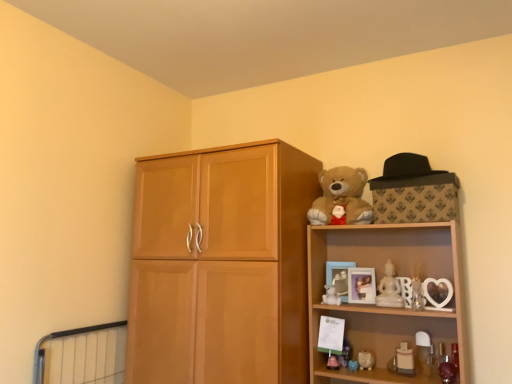
Question: Does white glossy piggy bank at lower right, the second toy viewed from the left, have a larger size compared to white glossy candle at lower right, the 2th toy when ordered from right to left?

Choices:
 (A) no
 (B) yes

Answer: (A)

Question: Is the position of white glossy piggy bank at lower right, the second toy viewed from the left, less distant than that of white glossy candle at lower right, the 2th toy when ordered from right to left?

Choices:
 (A) no
 (B) yes

Answer: (A)

Question: Is white glossy piggy bank at lower right, the second toy viewed from the left, behind white glossy candle at lower right, which is the 4th toy from left to right?

Choices:
 (A) no
 (B) yes

Answer: (B)

Question: Is white glossy piggy bank at lower right, the second toy viewed from the left, with white glossy candle at lower right, which is the 4th toy from left to right?

Choices:
 (A) no
 (B) yes

Answer: (A)

Question: Considering the relative sizes of white glossy piggy bank at lower right, the second toy viewed from the left, and white glossy candle at lower right, the 2th toy when ordered from right to left, in the image provided, is white glossy piggy bank at lower right, the second toy viewed from the left, taller than white glossy candle at lower right, the 2th toy when ordered from right to left,?

Choices:
 (A) yes
 (B) no

Answer: (B)

Question: Would you say white marble statue at upper center, marked as the third toy in a right-to-left arrangement, is inside or outside white glossy piggy bank at lower right, which is the fourth toy in right-to-left order?

Choices:
 (A) inside
 (B) outside

Answer: (B)

Question: Does point pyautogui.click(x=386, y=284) appear closer or farther from the camera than point pyautogui.click(x=372, y=360)?

Choices:
 (A) closer
 (B) farther

Answer: (A)

Question: Considering the positions of white marble statue at upper center, marked as the third toy in a right-to-left arrangement, and white glossy piggy bank at lower right, the second toy viewed from the left, in the image, is white marble statue at upper center, marked as the third toy in a right-to-left arrangement, wider or thinner than white glossy piggy bank at lower right, the second toy viewed from the left,?

Choices:
 (A) thin
 (B) wide

Answer: (A)

Question: Looking at the image, does white marble statue at upper center, the 3th toy viewed from the left, seem bigger or smaller compared to white glossy piggy bank at lower right, which is the fourth toy in right-to-left order?

Choices:
 (A) small
 (B) big

Answer: (B)

Question: From the image's perspective, relative to white matte teddy bear at upper right, which is the 5th toy in right-to-left order, is white glossy piggy bank at lower right, the second toy viewed from the left, above or below?

Choices:
 (A) below
 (B) above

Answer: (A)

Question: Is white glossy piggy bank at lower right, the second toy viewed from the left, inside or outside of white matte teddy bear at upper right, arranged as the first toy when viewed from the left?

Choices:
 (A) outside
 (B) inside

Answer: (A)

Question: In the image, is white glossy piggy bank at lower right, which is the fourth toy in right-to-left order, positioned in front of or behind white matte teddy bear at upper right, arranged as the first toy when viewed from the left?

Choices:
 (A) behind
 (B) front

Answer: (B)

Question: Based on their sizes in the image, would you say white glossy piggy bank at lower right, the second toy viewed from the left, is bigger or smaller than white matte teddy bear at upper right, which is the 5th toy in right-to-left order?

Choices:
 (A) big
 (B) small

Answer: (A)

Question: In the image, is black felt hat at upper right on the left side or the right side of soft plush teddy bear at upper right?

Choices:
 (A) left
 (B) right

Answer: (B)

Question: Considering the positions of black felt hat at upper right and soft plush teddy bear at upper right in the image, is black felt hat at upper right taller or shorter than soft plush teddy bear at upper right?

Choices:
 (A) short
 (B) tall

Answer: (A)